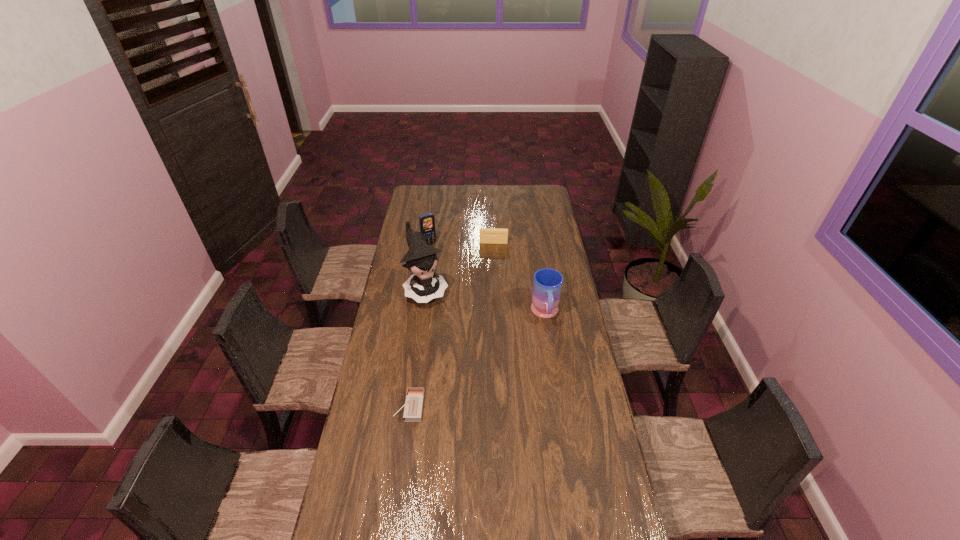
Locate an element on the screen. This screenshot has height=540, width=960. doll that is at the left edge is located at coordinates (425, 285).

This screenshot has width=960, height=540. In order to click on cellular telephone that is positioned at the left edge in this screenshot , I will do `click(427, 221)`.

I want to click on object present at the right edge, so click(547, 285).

The image size is (960, 540). What are the coordinates of `free location at the near edge` in the screenshot? It's located at (476, 526).

Locate an element on the screen. The height and width of the screenshot is (540, 960). free spot at the left edge of the desktop is located at coordinates (372, 401).

The width and height of the screenshot is (960, 540). In the image, there is a desktop. Identify the location of vacant space at the right edge. (604, 453).

Where is `vacant space at the far right corner of the desktop`? vacant space at the far right corner of the desktop is located at coordinates (542, 204).

Locate an element on the screen. This screenshot has height=540, width=960. vacant area between the tallest object and the matchbox is located at coordinates (418, 348).

The image size is (960, 540). Find the location of `free spot between the cellular telephone and the second shortest object`. free spot between the cellular telephone and the second shortest object is located at coordinates (461, 244).

Locate an element on the screen. free spot between the tallest object and the matchbox is located at coordinates (418, 348).